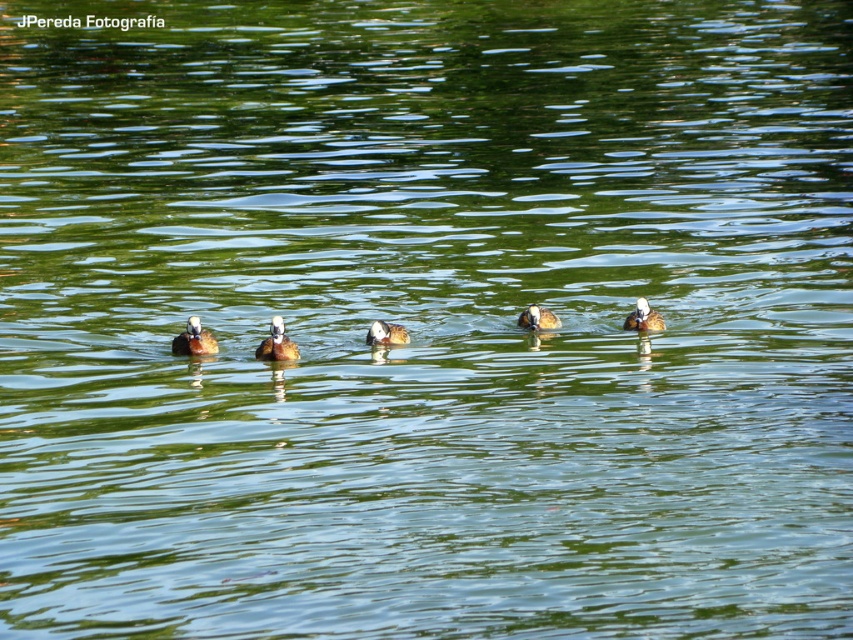
The image size is (853, 640). Describe the element at coordinates (276, 342) in the screenshot. I see `brown matte duck at center` at that location.

Does point (270, 356) come behind point (643, 310)?

No.

Locate an element on the screen. The height and width of the screenshot is (640, 853). brown matte duck at center is located at coordinates coord(276,342).

Locate an element on the screen. Image resolution: width=853 pixels, height=640 pixels. brown matte duck at center is located at coordinates (276, 342).

Is white fluffy duck at right shorter than brown fuzzy duck at center?

Incorrect, white fluffy duck at right's height does not fall short of brown fuzzy duck at center's.

Locate an element on the screen. This screenshot has height=640, width=853. white fluffy duck at right is located at coordinates (643, 317).

Where is `white fluffy duck at right`? white fluffy duck at right is located at coordinates (643, 317).

Can you confirm if brown fuzzy duckling at center is shorter than brown fuzzy duck at center?

Incorrect, brown fuzzy duckling at center's height does not fall short of brown fuzzy duck at center's.

Can you confirm if brown fuzzy duckling at center is wider than brown fuzzy duck at center?

Correct, the width of brown fuzzy duckling at center exceeds that of brown fuzzy duck at center.

Identify the location of brown fuzzy duckling at center. This screenshot has width=853, height=640. (194, 339).